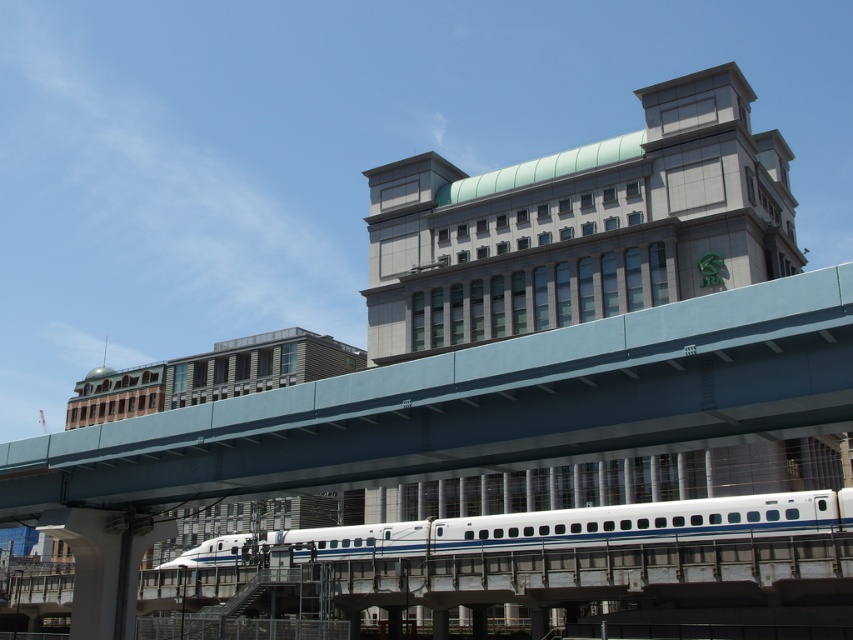
You are a maintenance worker needing to inspect the gap between the smooth concrete overpass at center and the white glossy passenger train at center. Your inspection tool requires a minimum clearance of 20 meters to operate safely. Can you use your tool in this location?

The distance between the smooth concrete overpass at center and the white glossy passenger train at center is 20.98 meters, which exceeds the required 20 meters clearance. Therefore, you can safely use your inspection tool in this location.

Based on the photo, you are standing at the point marked as point [479,406]. What structure are you under?

You are under the smooth concrete overpass at center located at point [479,406].